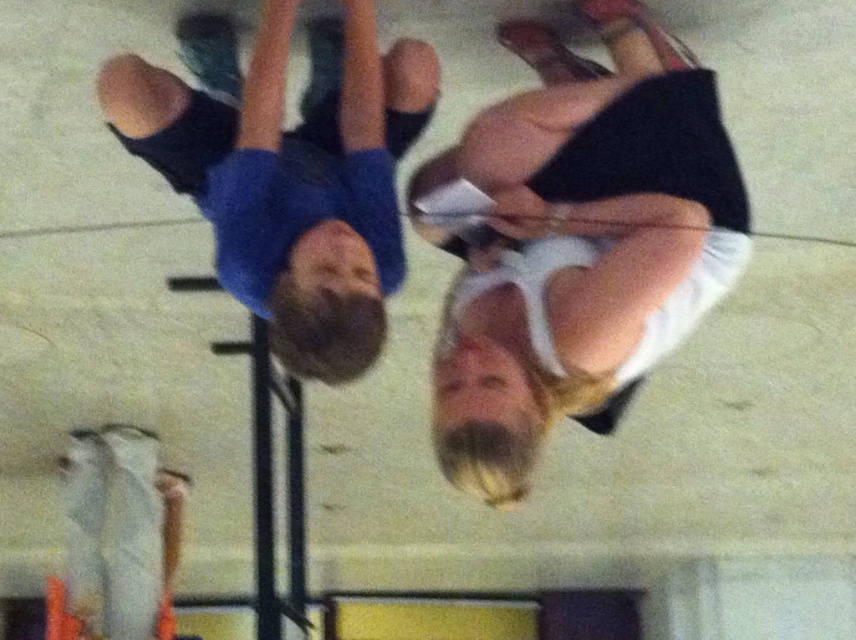
Is point (531, 381) behind point (176, 115)?

That is False.

Is white matte skirt at center smaller than blue cotton shirt at upper left?

Incorrect, white matte skirt at center is not smaller in size than blue cotton shirt at upper left.

Which is behind, point (489, 349) or point (369, 67)?

Positioned behind is point (369, 67).

This screenshot has height=640, width=856. Identify the location of white matte skirt at center. [x=575, y=244].